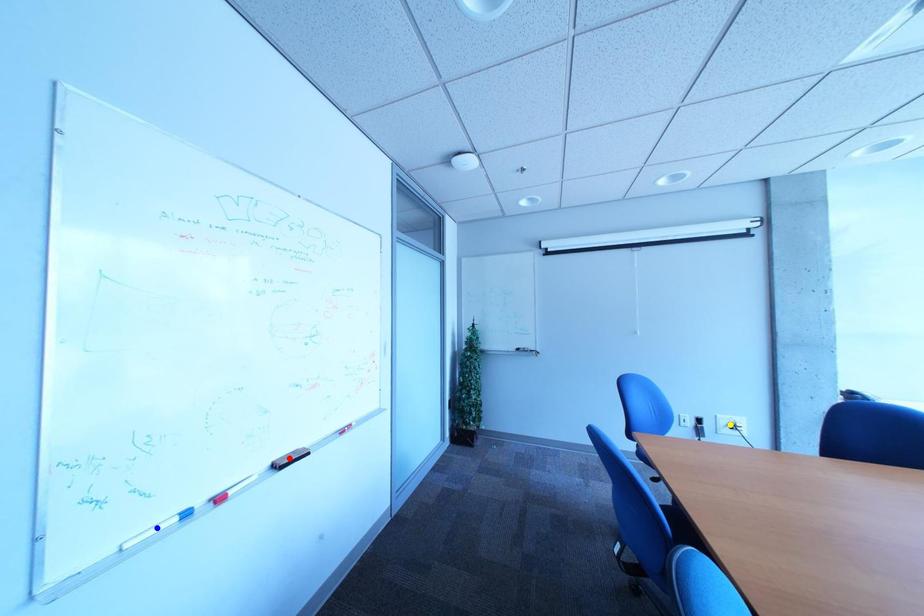
Order these from nearest to farthest:
1. yellow point
2. red point
3. blue point

blue point < red point < yellow point